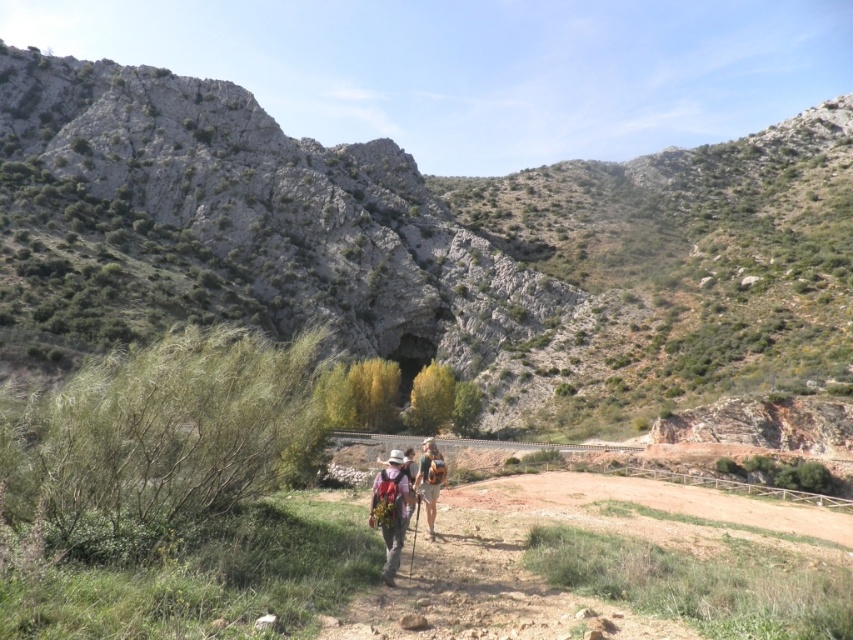
You are planning to set up a tent for the night. The rocky at center and the camouflage fabric backpack at center are in your way. Which object should you move to make more space?

You should move the camouflage fabric backpack at center because it is smaller than the rocky at center, making it easier to relocate for creating more space.

You are a hiker planning to traverse the rocky terrain at center in the mountainous landscape. Given that your average walking speed is 3 km per hour, how long will it take you to reach the rocky at center from your current position?

The rocky at center is 67.08 meters away from the viewer. At a speed of 3 km per hour, it would take approximately 2.24 minutes to reach the rocky at center.